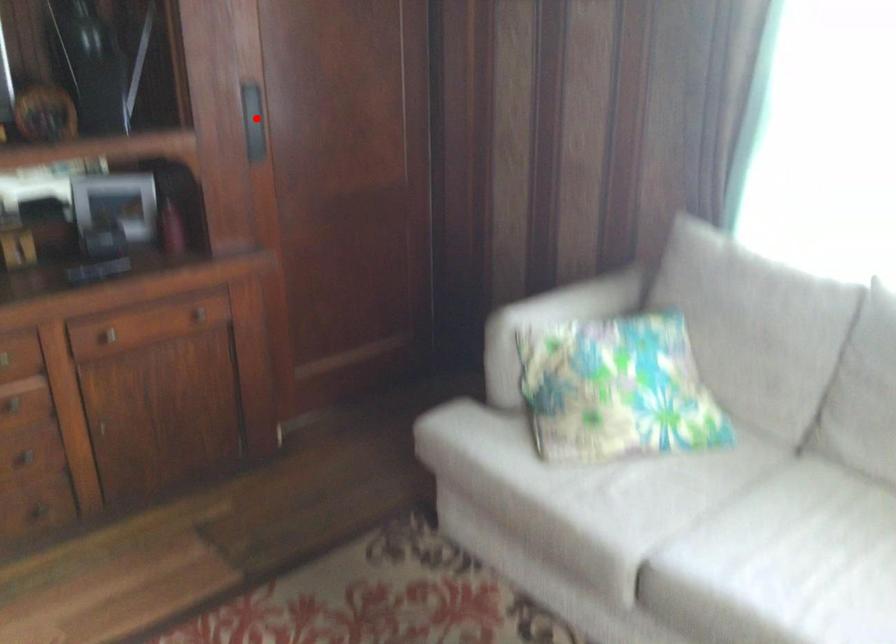
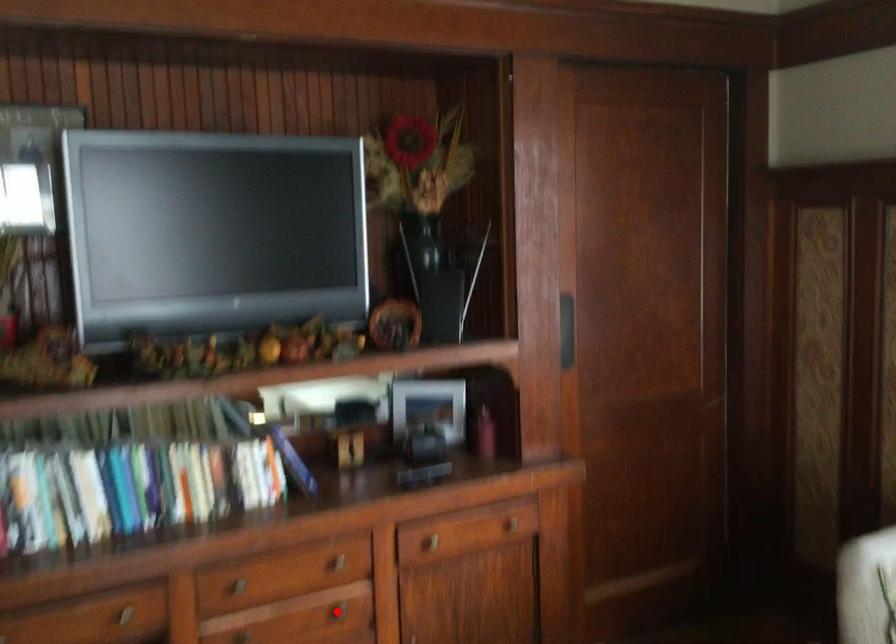
I am providing you with two images of the same scene from different viewpoints. A red point is marked on the first image and another point is marked on the second image. Does the point marked in image1 correspond to the same location as the one in image2?

No